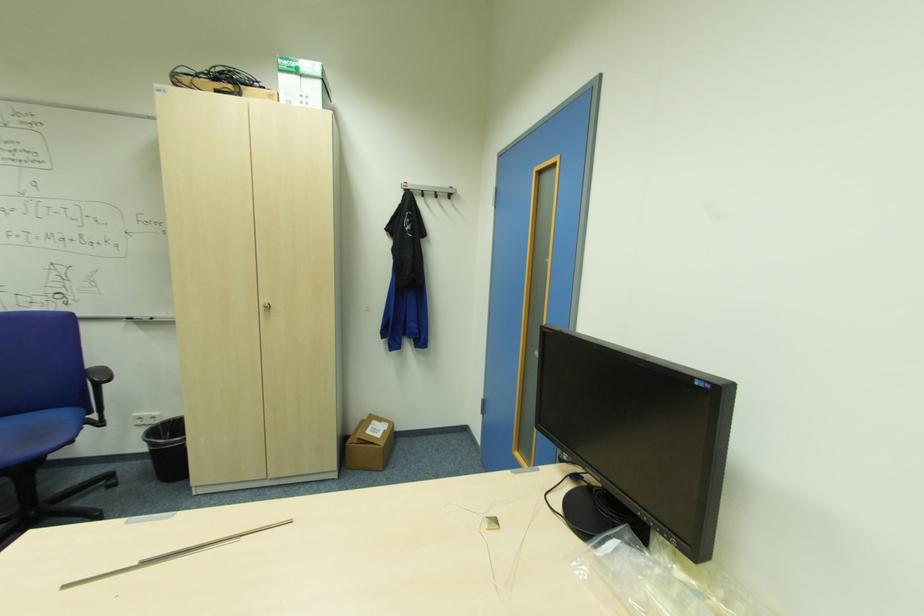
What do you see at coordinates (265, 306) in the screenshot? I see `a cabinet door handle` at bounding box center [265, 306].